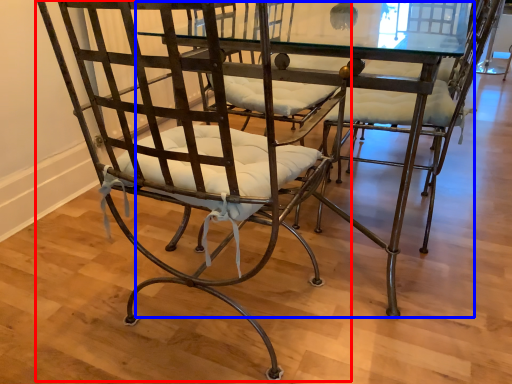
Question: Among these objects, which one is nearest to the camera, chair (highlighted by a red box) or round table (highlighted by a blue box)?

Choices:
 (A) chair
 (B) round table

Answer: (A)